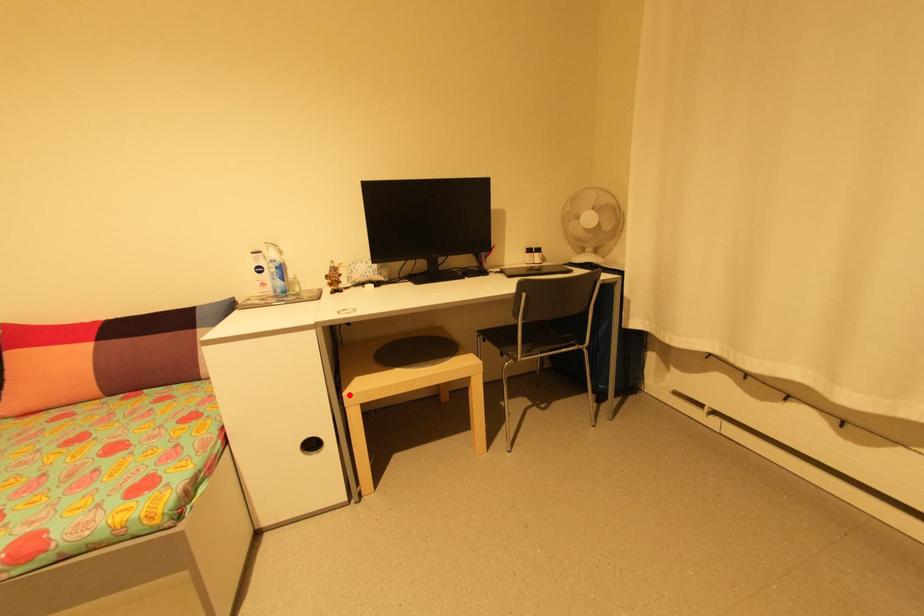
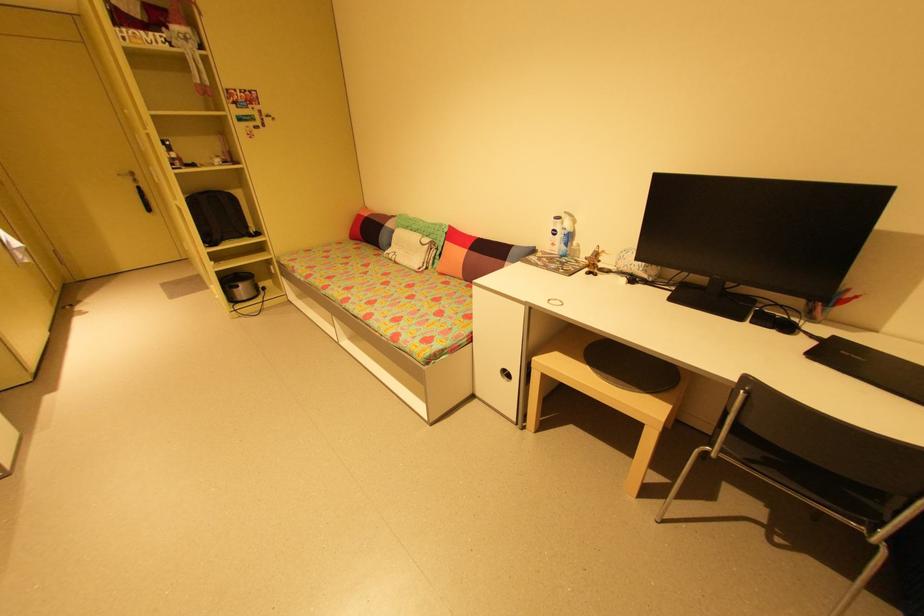
In the second image, find the point that corresponds to the highlighted location in the first image.

(540, 359)